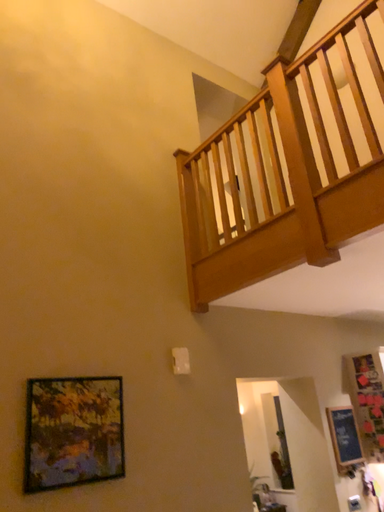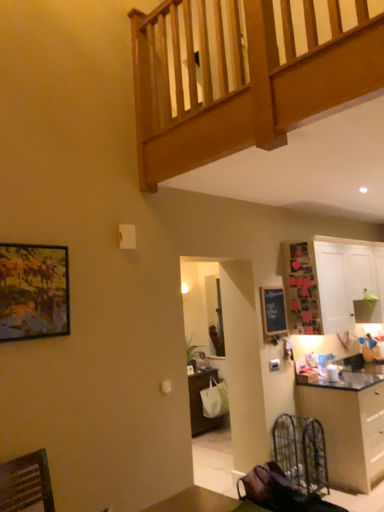
Question: How did the camera likely rotate when shooting the video?

Choices:
 (A) rotated upward
 (B) rotated downward

Answer: (B)